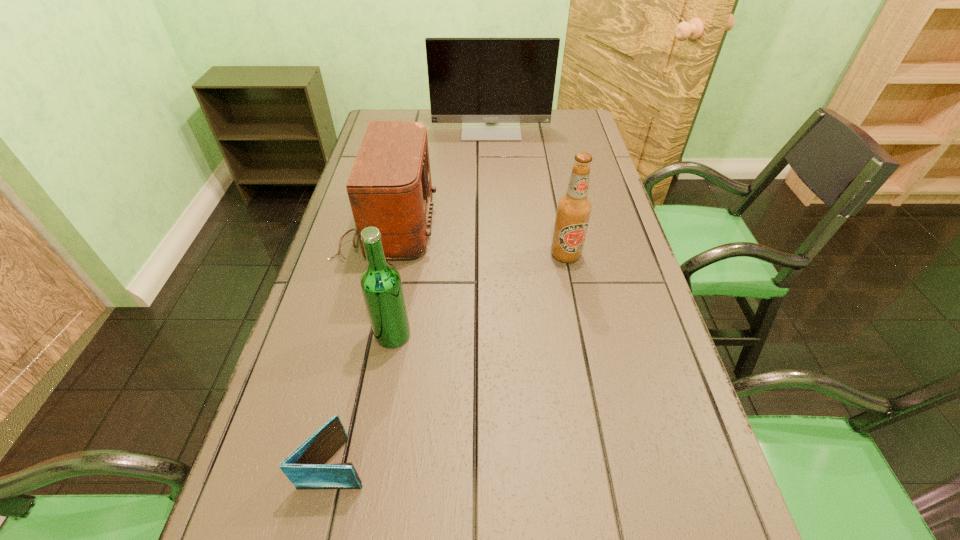
At what (x,y) coordinates should I click in order to perform the action: click on vacant space that is in between the nearest object and the radio receiver. Please return your answer as a coordinate pair (x, y). Looking at the image, I should click on (362, 345).

Identify the location of vacant space that is in between the shortest object and the second nearest object. (364, 399).

Choose which object is the second nearest neighbor to the radio receiver. Please provide its 2D coordinates. Your answer should be formatted as a tuple, i.e. [(x, y)], where the tuple contains the x and y coordinates of a point satisfying the conditions above.

[(573, 210)]

Identify which object is located as the second nearest to the nearest object. Please provide its 2D coordinates. Your answer should be formatted as a tuple, i.e. [(x, y)], where the tuple contains the x and y coordinates of a point satisfying the conditions above.

[(389, 187)]

This screenshot has width=960, height=540. Find the location of `free region that satisfies the following two spatial constraints: 1. on the front label of the farther beer bottle; 2. on the exterior surface of the nearest object`. free region that satisfies the following two spatial constraints: 1. on the front label of the farther beer bottle; 2. on the exterior surface of the nearest object is located at coordinates (607, 462).

Image resolution: width=960 pixels, height=540 pixels. Find the location of `vacant area in the image that satisfies the following two spatial constraints: 1. on the screen of the computer monitor; 2. on the front panel of the radio receiver`. vacant area in the image that satisfies the following two spatial constraints: 1. on the screen of the computer monitor; 2. on the front panel of the radio receiver is located at coordinates (494, 226).

Locate an element on the screen. The width and height of the screenshot is (960, 540). free space that satisfies the following two spatial constraints: 1. on the front label of the farther beer bottle; 2. on the exterior surface of the wallet is located at coordinates (607, 462).

Find the location of a particular element. free region that satisfies the following two spatial constraints: 1. on the front panel of the second shortest object; 2. on the left side of the nearer beer bottle is located at coordinates (363, 335).

You are a GUI agent. You are given a task and a screenshot of the screen. Output one action in this format:
    pyautogui.click(x=<x>, y=<y>)
    Task: Click on the free space that satisfies the following two spatial constraints: 1. on the front label of the farther beer bottle; 2. on the exterior surface of the shortest object
    
    Given the screenshot: What is the action you would take?
    pyautogui.click(x=607, y=462)